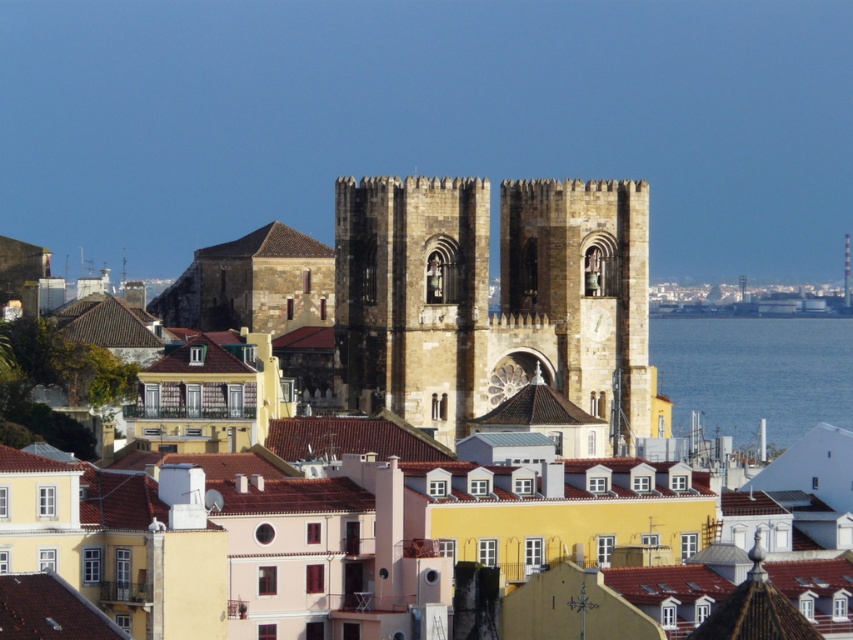
You are standing on the blue water at right and want to visit the brown stone church at center. Which direction should you move to reach it?

The brown stone church at center is located above the blue water at right, so you should move upward to reach it.

Based on the photo, you are standing at the origin point in the urban landscape. The brown stone church at center is at coordinates 0.698 in the x and 0.454 in the y. If you want to walk directly towards the church, which direction should you head?

The brown stone church at center is located at coordinates x 0.698 and y 0.454. Since the origin is at (0, 0), moving towards higher x means east and higher y means north. Therefore, to reach the church, you should head northeast.